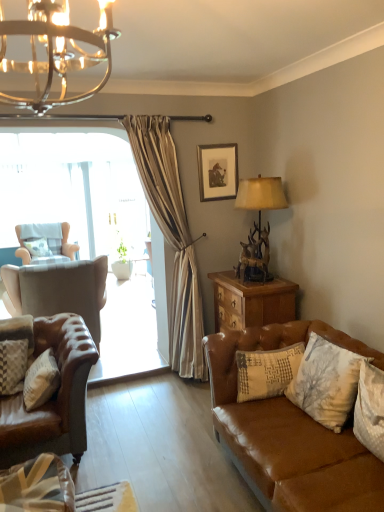
The width and height of the screenshot is (384, 512). What do you see at coordinates (370, 409) in the screenshot?
I see `white textured pillow at lower right, the 1th pillow when ordered from right to left` at bounding box center [370, 409].

The width and height of the screenshot is (384, 512). What do you see at coordinates (38, 485) in the screenshot?
I see `plaid fabric pillow at lower left, positioned as the first pillow in front-to-back order` at bounding box center [38, 485].

What is the approximate width of leather armchair at left, acting as the second chair starting from the left?

leather armchair at left, acting as the second chair starting from the left, is 29.39 inches wide.

Measure the distance between point [22,244] and camera.

Point [22,244] and camera are 5.84 meters apart from each other.

The image size is (384, 512). Describe the element at coordinates (266, 371) in the screenshot. I see `textured beige pillow at center right, the 2th pillow from the back` at that location.

You are a GUI agent. You are given a task and a screenshot of the screen. Output one action in this format:
    pyautogui.click(x=<x>, y=<y>)
    Task: Click on the white textured pillow at lower right, arranged as the 2th pillow when viewed from the right
    The height and width of the screenshot is (512, 384).
    Given the screenshot: What is the action you would take?
    pyautogui.click(x=326, y=382)

Where is `patterned fabric pillow at left, the 5th pillow when ordered from right to left`? patterned fabric pillow at left, the 5th pillow when ordered from right to left is located at coordinates (38, 247).

What do you see at coordinates (38, 247) in the screenshot?
I see `patterned fabric pillow at left, marked as the fifth pillow in a front-to-back arrangement` at bounding box center [38, 247].

Identify the location of white textured pillow at lower right, arranged as the 5th pillow when viewed from the left. The image size is (384, 512). (370, 409).

Considering their positions, is patterned fabric pillow at left, which is the first pillow from left to right, located in front of or behind white textured pillow at lower right, acting as the third pillow starting from the front?

In the image, patterned fabric pillow at left, which is the first pillow from left to right, appears behind white textured pillow at lower right, acting as the third pillow starting from the front.

Is point (33, 254) closer to viewer compared to point (336, 378)?

No, (33, 254) is further to viewer.

From the image's perspective, would you say patterned fabric pillow at left, the 5th pillow when ordered from right to left, is shown under white textured pillow at lower right, marked as the 4th pillow in a left-to-right arrangement?

Actually, patterned fabric pillow at left, the 5th pillow when ordered from right to left, appears above white textured pillow at lower right, marked as the 4th pillow in a left-to-right arrangement, in the image.

In the image, is patterned fabric pillow at left, marked as the fifth pillow in a front-to-back arrangement, on the left side or the right side of white textured pillow at lower right, which appears as the third pillow when viewed from the back?

From the image, it's evident that patterned fabric pillow at left, marked as the fifth pillow in a front-to-back arrangement, is to the left of white textured pillow at lower right, which appears as the third pillow when viewed from the back.

From the image's perspective, is wooden picture frame at upper center located above or below plaid fabric pillow at lower left, the fourth pillow when ordered from right to left?

wooden picture frame at upper center is situated higher than plaid fabric pillow at lower left, the fourth pillow when ordered from right to left, in the image.

Does wooden picture frame at upper center have a smaller size compared to plaid fabric pillow at lower left, positioned as the first pillow in front-to-back order?

Indeed, wooden picture frame at upper center has a smaller size compared to plaid fabric pillow at lower left, positioned as the first pillow in front-to-back order.

Is wooden picture frame at upper center taller or shorter than plaid fabric pillow at lower left, the 2th pillow in the left-to-right sequence?

Clearly, wooden picture frame at upper center is taller compared to plaid fabric pillow at lower left, the 2th pillow in the left-to-right sequence.

Is wooden picture frame at upper center far from plaid fabric pillow at lower left, the 2th pillow in the left-to-right sequence?

Yes, wooden picture frame at upper center is far from plaid fabric pillow at lower left, the 2th pillow in the left-to-right sequence.

Is point (43, 505) positioned in front of point (60, 312)?

Yes.

From a real-world perspective, which object rests below the other?

plaid fabric pillow at lower left, the fourth pillow when ordered from right to left.

Which of these two, plaid fabric pillow at lower left, the 2th pillow in the left-to-right sequence, or leather armchair at left, the second chair in the back-to-front sequence, is smaller?

With smaller size is plaid fabric pillow at lower left, the 2th pillow in the left-to-right sequence.

Who is more distant, plaid fabric pillow at lower left, the 2th pillow in the left-to-right sequence, or leather armchair at left, which appears as the first chair when viewed from the right?

leather armchair at left, which appears as the first chair when viewed from the right, is further away from the camera.

From a real-world perspective, is brown leather couch at lower right physically below patterned fabric pillow at left, the 5th pillow when ordered from right to left?

Yes.

Which object is thinner, brown leather couch at lower right or patterned fabric pillow at left, the 5th pillow when ordered from right to left?

Thinner between the two is patterned fabric pillow at left, the 5th pillow when ordered from right to left.

Can you confirm if brown leather couch at lower right is bigger than patterned fabric pillow at left, which is the 1th pillow in back-to-front order?

Correct, brown leather couch at lower right is larger in size than patterned fabric pillow at left, which is the 1th pillow in back-to-front order.

Would you say patterned fabric pillow at left, which is the first pillow from left to right, is part of brown leather couch at lower right's contents?

Actually, patterned fabric pillow at left, which is the first pillow from left to right, is outside brown leather couch at lower right.

Which of these two, light beige fabric wingback chair at left, which is the 1th chair from back to front, or plaid fabric pillow at lower left, which is the 5th pillow in back-to-front order, stands taller?

With more height is light beige fabric wingback chair at left, which is the 1th chair from back to front.

From the picture: How different are the orientations of light beige fabric wingback chair at left, which is the 1th chair from back to front, and plaid fabric pillow at lower left, the fourth pillow when ordered from right to left, in degrees?

The facing directions of light beige fabric wingback chair at left, which is the 1th chair from back to front, and plaid fabric pillow at lower left, the fourth pillow when ordered from right to left, are 7.09 degrees apart.

Is light beige fabric wingback chair at left, acting as the 1th chair starting from the left, further to the viewer compared to plaid fabric pillow at lower left, the 2th pillow in the left-to-right sequence?

Yes, it is behind plaid fabric pillow at lower left, the 2th pillow in the left-to-right sequence.

Can you confirm if light beige fabric wingback chair at left, acting as the 1th chair starting from the left, is bigger than plaid fabric pillow at lower left, positioned as the first pillow in front-to-back order?

Indeed, light beige fabric wingback chair at left, acting as the 1th chair starting from the left, has a larger size compared to plaid fabric pillow at lower left, positioned as the first pillow in front-to-back order.

Does point (22, 246) appear closer or farther from the camera than point (16, 28)?

Point (22, 246) is farther from the camera than point (16, 28).

Consider the image. Is light beige fabric wingback chair at left, arranged as the second chair when viewed from the front, inside or outside of chrome/metallic chandelier at upper left?

light beige fabric wingback chair at left, arranged as the second chair when viewed from the front, lies outside chrome/metallic chandelier at upper left.

Is plaid fabric pillow at lower left, positioned as the first pillow in front-to-back order, wider than wooden picture frame at upper center?

Indeed, plaid fabric pillow at lower left, positioned as the first pillow in front-to-back order, has a greater width compared to wooden picture frame at upper center.

In order to click on picture frame located behind the plaid fabric pillow at lower left, positioned as the first pillow in front-to-back order in this screenshot , I will do `click(217, 170)`.

Would you say plaid fabric pillow at lower left, the 2th pillow in the left-to-right sequence, is inside or outside wooden picture frame at upper center?

plaid fabric pillow at lower left, the 2th pillow in the left-to-right sequence, exists outside the volume of wooden picture frame at upper center.

Locate an element on the screen. The width and height of the screenshot is (384, 512). the 2nd pillow above the white textured pillow at lower right, arranged as the 2th pillow when viewed from the right (from a real-world perspective) is located at coordinates (38, 247).

This screenshot has width=384, height=512. Find the location of `picture frame above the plaid fabric pillow at lower left, the fourth pillow when ordered from right to left (from the image's perspective)`. picture frame above the plaid fabric pillow at lower left, the fourth pillow when ordered from right to left (from the image's perspective) is located at coordinates (217, 170).

From the image, which object appears to be nearer to wooden picture frame at upper center, chrome/metallic chandelier at upper left or antique bronze lamp at upper right?

Among the two, antique bronze lamp at upper right is located nearer to wooden picture frame at upper center.

When comparing their distances from wooden picture frame at upper center, does brown wood nightstand at right or antique bronze lamp at upper right seem closer?

Among the two, antique bronze lamp at upper right is located nearer to wooden picture frame at upper center.

Which object lies further to the anchor point patterned fabric pillow at left, marked as the fifth pillow in a front-to-back arrangement, chrome/metallic chandelier at upper left or light beige fabric wingback chair at left, the 2th chair in the right-to-left sequence?

chrome/metallic chandelier at upper left is further to patterned fabric pillow at left, marked as the fifth pillow in a front-to-back arrangement.

When comparing their distances from antique bronze lamp at upper right, does leather armchair at left, which ranks as the 1th chair in front-to-back order, or chrome/metallic chandelier at upper left seem further?

Based on the image, chrome/metallic chandelier at upper left appears to be further to antique bronze lamp at upper right.

Based on their spatial positions, is white textured pillow at lower right, the 4th pillow when ordered from back to front, or patterned fabric pillow at left, the 5th pillow when ordered from right to left, closer to leather armchair at left, which appears as the first chair when viewed from the right?

Based on the image, patterned fabric pillow at left, the 5th pillow when ordered from right to left, appears to be nearer to leather armchair at left, which appears as the first chair when viewed from the right.

From the image, which object appears to be farther from chrome/metallic chandelier at upper left, wooden picture frame at upper center or light beige fabric wingback chair at left, which is the 1th chair from back to front?

The object further to chrome/metallic chandelier at upper left is light beige fabric wingback chair at left, which is the 1th chair from back to front.

Estimate the real-world distances between objects in this image. Which object is closer to chrome/metallic chandelier at upper left, brown leather couch at lower right or textured beige pillow at center right, acting as the third pillow starting from the right?

The object closer to chrome/metallic chandelier at upper left is brown leather couch at lower right.

Estimate the real-world distances between objects in this image. Which object is further from textured beige pillow at center right, acting as the third pillow starting from the left, chrome/metallic chandelier at upper left or light beige fabric wingback chair at left, arranged as the second chair when viewed from the front?

light beige fabric wingback chair at left, arranged as the second chair when viewed from the front, is further to textured beige pillow at center right, acting as the third pillow starting from the left.

Locate an element on the screen. Image resolution: width=384 pixels, height=512 pixels. pillow between plaid fabric pillow at lower left, the 2th pillow in the left-to-right sequence, and brown wood nightstand at right is located at coordinates (266, 371).

At what (x,y) coordinates should I click in order to perform the action: click on picture frame between leather armchair at left, which appears as the first chair when viewed from the right, and antique bronze lamp at upper right from left to right. Please return your answer as a coordinate pair (x, y). The width and height of the screenshot is (384, 512). Looking at the image, I should click on (217, 170).

You are a GUI agent. You are given a task and a screenshot of the screen. Output one action in this format:
    pyautogui.click(x=<x>, y=<y>)
    Task: Click on the nightstand between leather armchair at left, which appears as the first chair when viewed from the right, and white textured pillow at lower right, which appears as the third pillow when viewed from the back, from left to right
    
    Given the screenshot: What is the action you would take?
    pyautogui.click(x=251, y=301)

Where is `picture frame between brown leather couch at lower right and light beige fabric wingback chair at left, arranged as the second chair when viewed from the front, along the z-axis`? picture frame between brown leather couch at lower right and light beige fabric wingback chair at left, arranged as the second chair when viewed from the front, along the z-axis is located at coordinates (217, 170).